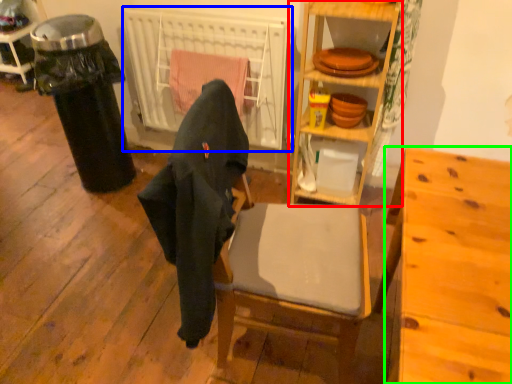
Question: Which is farther away from shelf (highlighted by a red box)? radiator (highlighted by a blue box) or desk (highlighted by a green box)?

Choices:
 (A) radiator
 (B) desk

Answer: (B)